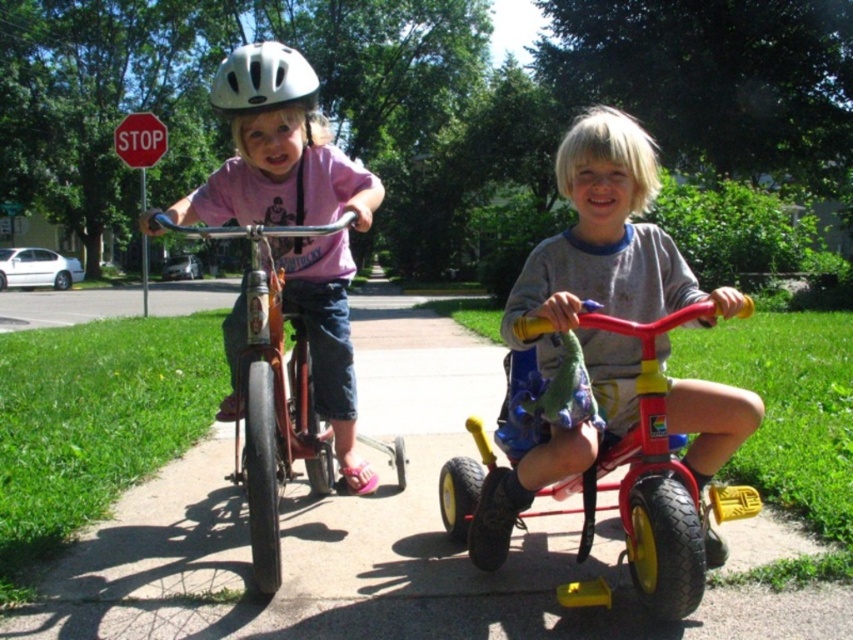
You are a delivery drone that needs to fly from the matte red tricycle at center to the red plastic stop sign at upper left. The drone has a maximum flight range of 10 meters. Can it reach the stop sign without needing to recharge?

The matte red tricycle at center is 11.08 meters from the red plastic stop sign at upper left, so the drone cannot reach the stop sign without recharging because the distance exceeds its 10 meter range.

You are a parent trying to decide which bicycle to choose for your child. You see an orange matte bicycle at left and a white matte helmet at upper center in the image. Based on their sizes, which bicycle would be more suitable for a younger child?

The orange matte bicycle at left has a smaller size compared to the white matte helmet at upper center, so the orange matte bicycle at left would be more suitable for a younger child.